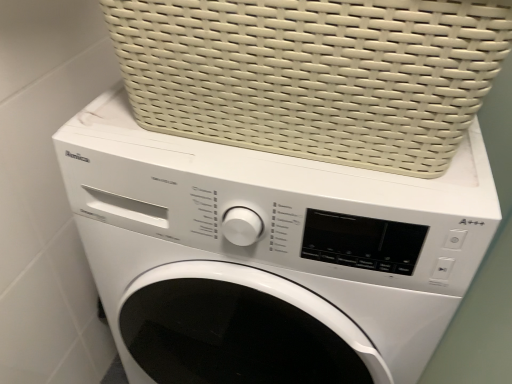
Describe the element at coordinates (269, 254) in the screenshot. I see `white glossy washing machine at center` at that location.

Where is `white glossy washing machine at center`? The image size is (512, 384). white glossy washing machine at center is located at coordinates (269, 254).

What is the approximate height of white glossy washing machine at center?

The height of white glossy washing machine at center is 85.78 centimeters.

Find the location of a particular element. Image resolution: width=512 pixels, height=384 pixels. white woven basket at upper center is located at coordinates (314, 74).

What is the approximate width of white woven basket at upper center?

white woven basket at upper center is 17.29 inches wide.

What do you see at coordinates (314, 74) in the screenshot? The image size is (512, 384). I see `white woven basket at upper center` at bounding box center [314, 74].

Locate an element on the screen. This screenshot has height=384, width=512. white glossy washing machine at center is located at coordinates (269, 254).

Which is more to the left, white glossy washing machine at center or white woven basket at upper center?

Positioned to the left is white glossy washing machine at center.

Relative to white woven basket at upper center, is white glossy washing machine at center in front or behind?

white glossy washing machine at center is positioned farther from the viewer than white woven basket at upper center.

Does point (77, 191) appear closer or farther from the camera than point (205, 14)?

Clearly, point (77, 191) is more distant from the camera than point (205, 14).

From the image's perspective, is white glossy washing machine at center on top of white woven basket at upper center?

No.

From a real-world perspective, is white glossy washing machine at center positioned over white woven basket at upper center based on gravity?

No, from a real-world perspective, white glossy washing machine at center is not over white woven basket at upper center

Considering the relative sizes of white glossy washing machine at center and white woven basket at upper center in the image provided, is white glossy washing machine at center wider than white woven basket at upper center?

Yes.

Considering the relative sizes of white glossy washing machine at center and white woven basket at upper center in the image provided, is white glossy washing machine at center taller than white woven basket at upper center?

Correct, white glossy washing machine at center is much taller as white woven basket at upper center.

Based on the photo, between white glossy washing machine at center and white woven basket at upper center, which one has larger size?

white glossy washing machine at center is bigger.

Does white glossy washing machine at center contain white woven basket at upper center?

No.

Is there a large distance between white glossy washing machine at center and white woven basket at upper center?

Actually, white glossy washing machine at center and white woven basket at upper center are a little close together.

Is white glossy washing machine at center positioned with its back to white woven basket at upper center?

No, white woven basket at upper center is not at the back of white glossy washing machine at center.

How different are the orientations of white glossy washing machine at center and white woven basket at upper center in degrees?

0.0001 degrees separate the facing orientations of white glossy washing machine at center and white woven basket at upper center.

In the scene shown: Measure the distance between white glossy washing machine at center and white woven basket at upper center.

A distance of 17.86 centimeters exists between white glossy washing machine at center and white woven basket at upper center.

Locate an element on the screen. The height and width of the screenshot is (384, 512). basket located above the white glossy washing machine at center (from the image's perspective) is located at coordinates (314, 74).

Considering the relative positions of white woven basket at upper center and white glossy washing machine at center in the image provided, is white woven basket at upper center to the left or to the right of white glossy washing machine at center?

Clearly, white woven basket at upper center is on the right of white glossy washing machine at center in the image.

Does white woven basket at upper center lie behind white glossy washing machine at center?

No, it is in front of white glossy washing machine at center.

Is point (186, 26) positioned before point (274, 312)?

Yes, point (186, 26) is closer to viewer.

From the image's perspective, is white woven basket at upper center located above or below white glossy washing machine at center?

white woven basket at upper center is above white glossy washing machine at center.

From a real-world perspective, between white woven basket at upper center and white glossy washing machine at center, who is vertically higher?

white woven basket at upper center, from a real-world perspective.

Which object is thinner, white woven basket at upper center or white glossy washing machine at center?

white woven basket at upper center is thinner.

Between white woven basket at upper center and white glossy washing machine at center, which one has more height?

With more height is white glossy washing machine at center.

Is white woven basket at upper center bigger than white glossy washing machine at center?

No.

Is white woven basket at upper center surrounding white glossy washing machine at center?

Actually, white glossy washing machine at center is outside white woven basket at upper center.

Are white woven basket at upper center and white glossy washing machine at center far apart?

They are positioned close to each other.

Is white woven basket at upper center looking in the opposite direction of white glossy washing machine at center?

No, white glossy washing machine at center is not at the back of white woven basket at upper center.

Measure the distance from white woven basket at upper center to white glossy washing machine at center.

white woven basket at upper center and white glossy washing machine at center are 7.03 inches apart from each other.

Image resolution: width=512 pixels, height=384 pixels. I want to click on washing machine located behind the white woven basket at upper center, so [269, 254].

Identify the location of basket in front of the white glossy washing machine at center. (314, 74).

Where is `washing machine that is below the white woven basket at upper center (from the image's perspective)`? Image resolution: width=512 pixels, height=384 pixels. washing machine that is below the white woven basket at upper center (from the image's perspective) is located at coordinates (269, 254).